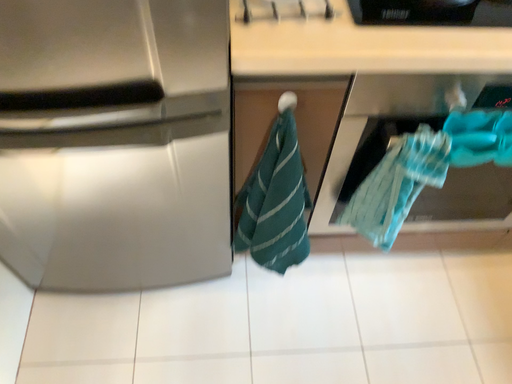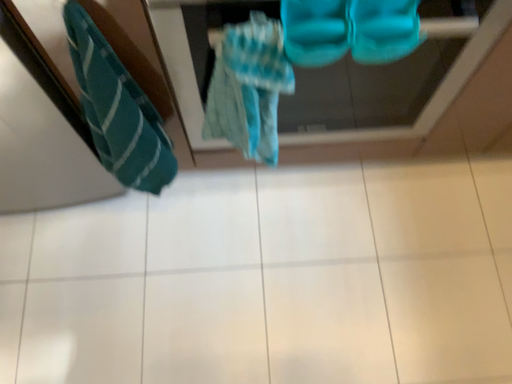
Question: How did the camera likely rotate when shooting the video?

Choices:
 (A) rotated upward
 (B) rotated downward

Answer: (B)